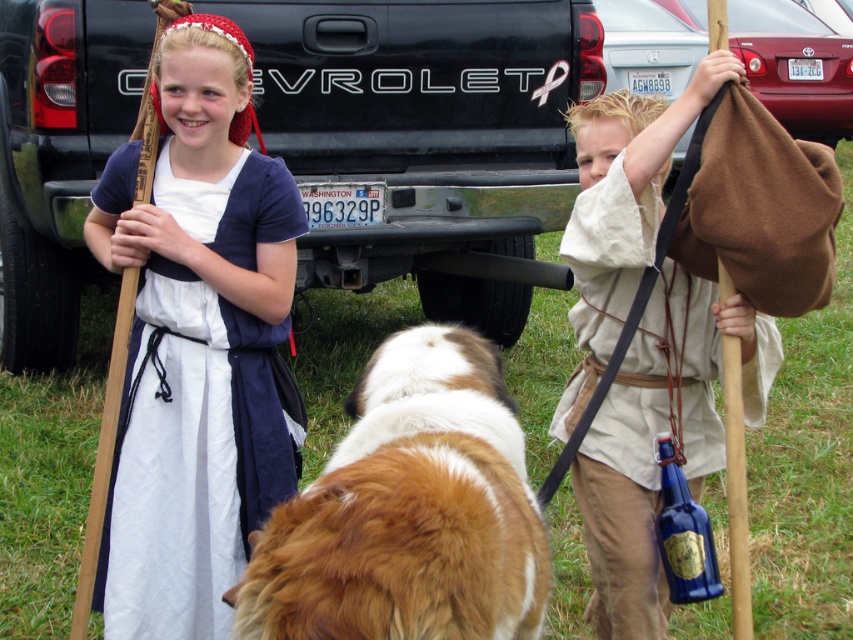
Question: Does brown fluffy dog at center come behind matte brown cloth at upper right?

Choices:
 (A) yes
 (B) no

Answer: (B)

Question: Is the position of matte blue dress at center less distant than that of matte brown cloth at upper right?

Choices:
 (A) yes
 (B) no

Answer: (B)

Question: Does matte blue dress at center have a smaller size compared to brown fluffy dog at center?

Choices:
 (A) yes
 (B) no

Answer: (B)

Question: Which object appears farthest from the camera in this image?

Choices:
 (A) brown fluffy dog at center
 (B) matte blue dress at center

Answer: (B)

Question: Which of the following is the farthest from the observer?

Choices:
 (A) (254, 634)
 (B) (643, 436)

Answer: (B)

Question: Considering the real-world distances, which object is closest to the matte brown cloth at upper right?

Choices:
 (A) brown fluffy dog at center
 (B) matte blue dress at center

Answer: (A)